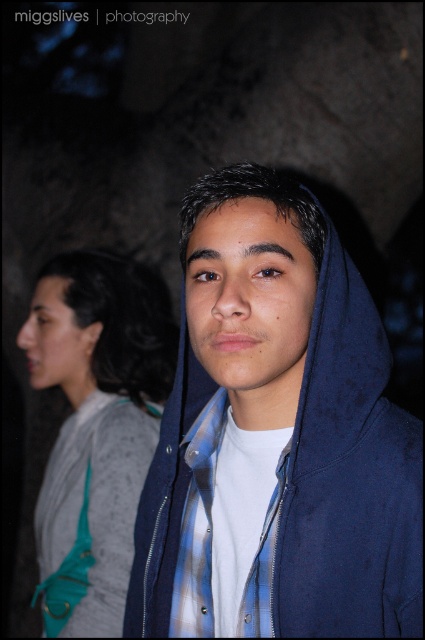
Can you confirm if teal fabric purse at left is positioned to the right of blue plaid shirt at center?

In fact, teal fabric purse at left is to the left of blue plaid shirt at center.

Between teal fabric purse at left and blue plaid shirt at center, which one is positioned higher?

Positioned higher is blue plaid shirt at center.

Between point (93, 467) and point (251, 628), which one is positioned in front?

Point (251, 628) is more forward.

The image size is (425, 640). In order to click on teal fabric purse at left in this screenshot , I will do `click(91, 515)`.

Does blue velvety hoodie at center have a greater width compared to teal fabric purse at left?

Correct, the width of blue velvety hoodie at center exceeds that of teal fabric purse at left.

Between blue velvety hoodie at center and teal fabric purse at left, which one has more height?

With more height is teal fabric purse at left.

Identify the location of blue velvety hoodie at center. Image resolution: width=425 pixels, height=640 pixels. (350, 480).

Which is behind, point (391, 417) or point (206, 412)?

Positioned behind is point (206, 412).

Is blue velvety hoodie at center thinner than blue plaid shirt at center?

No, blue velvety hoodie at center is not thinner than blue plaid shirt at center.

At what (x,y) coordinates should I click in order to perform the action: click on blue velvety hoodie at center. Please return your answer as a coordinate pair (x, y). The image size is (425, 640). Looking at the image, I should click on (350, 480).